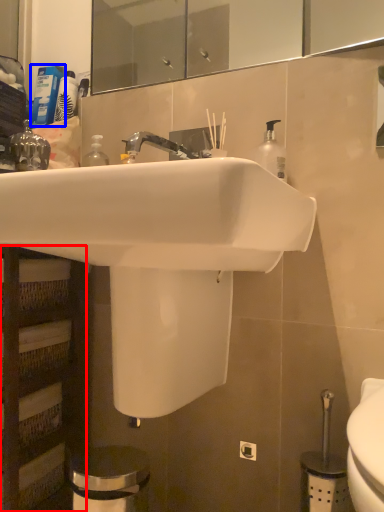
Question: Which object appears farthest to the camera in this image, shelf (highlighted by a red box) or toiletry (highlighted by a blue box)?

Choices:
 (A) shelf
 (B) toiletry

Answer: (B)